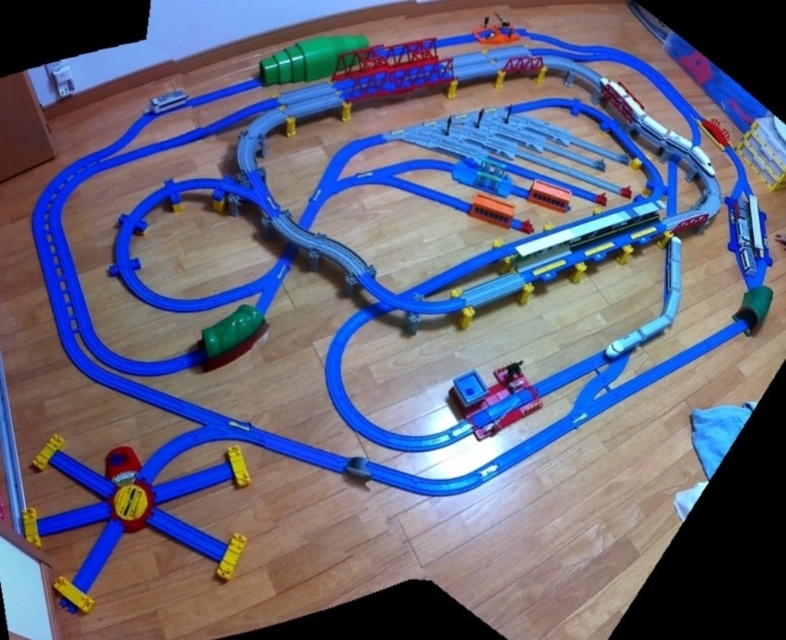
You are a child playing with the toy train set. You want to move the translucent plastic train at center to the shiny yellow plastic track at bottom left. Which direction should you move it?

The shiny yellow plastic track at bottom left is to the left of the translucent plastic train at center, so you should move the translucent plastic train at center to the left to reach it.

You are a child trying to place a sticker on the translucent plastic train at center. The sticker is 0.5 cm in diameter. Can you place it on the point at coordinates (493, 396)?

The point at coordinates (493, 396) is on the translucent plastic train at center, so yes, you can place the sticker there.

Consider the image. You are a parent setting up a toy train set for your child. You have a shiny yellow plastic track at bottom left and a shiny metallic train at upper right. Which object should you place first if you want to ensure the train can move smoothly on the track?

You should place the shiny yellow plastic track at bottom left first because it is larger in size than the shiny metallic train at upper right, ensuring there is enough space for the train to move smoothly.